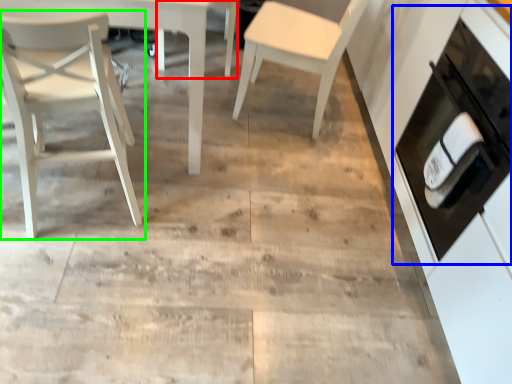
Question: Which is farther away from chair (highlighted by a red box)? cabinetry (highlighted by a blue box) or chair (highlighted by a green box)?

Choices:
 (A) cabinetry
 (B) chair

Answer: (A)